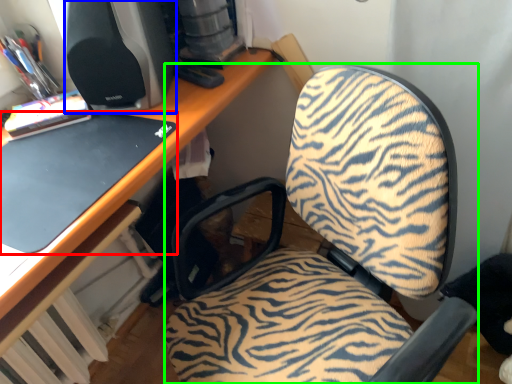
Question: Which object is the farthest from laptop (highlighted by a red box)? Choose among these: desktop computer (highlighted by a blue box) or furniture (highlighted by a green box).

Choices:
 (A) desktop computer
 (B) furniture

Answer: (B)